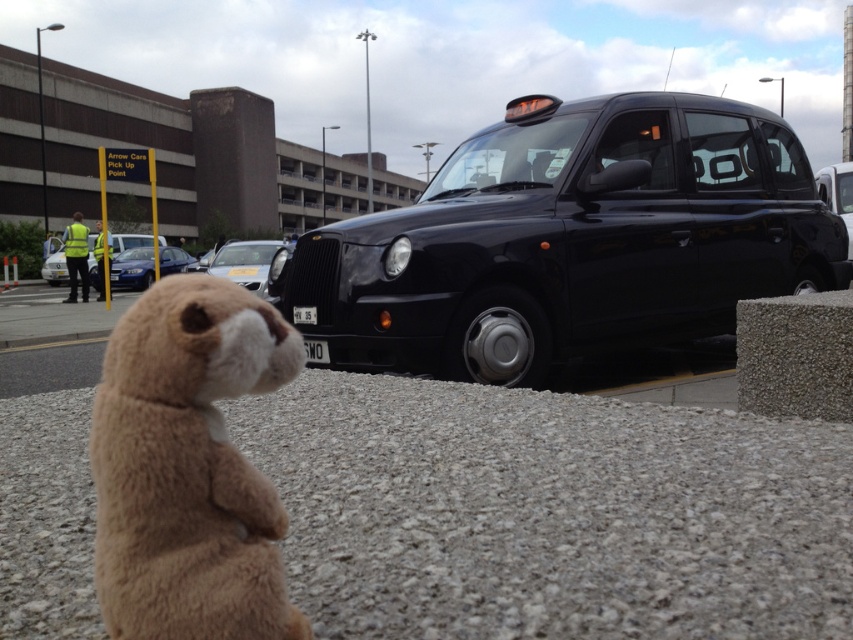
You are a delivery person who needs to place a package between the brown plush toy at lower left and the silver metallic car at center. The package requires a minimum of 30 feet of space to be safely placed. Based on the scene, can you safely place the package there?

The brown plush toy at lower left is 28.64 feet from the silver metallic car at center, which is less than the required 30 feet. Therefore, you cannot safely place the package between them.

Based on the scene description, where is the gray gravel at lower center located in terms of its 2D coordinates?

The gray gravel at lower center is located at the 2D coordinates point (550, 513).

You are a delivery person trying to place a small package on the ground near the gray gravel at lower center and the brown plush toy at lower left. Which surface is higher so the package won not roll away?

The brown plush toy at lower left is taller than the gray gravel at lower center, so placing the package there would prevent it from rolling away.